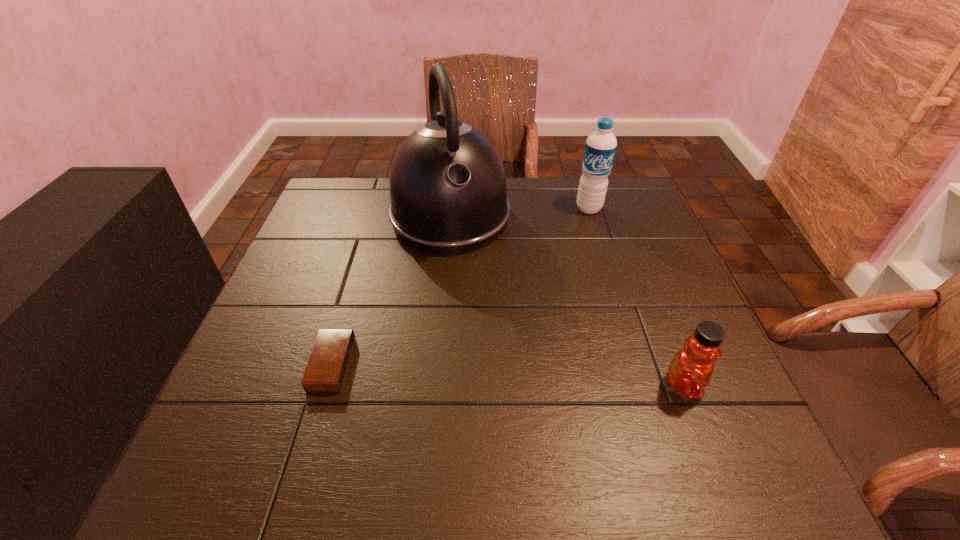
Locate an element on the screen. This screenshot has width=960, height=540. vacant region at the far right corner is located at coordinates (627, 215).

You are a GUI agent. You are given a task and a screenshot of the screen. Output one action in this format:
    pyautogui.click(x=<x>, y=<y>)
    Task: Click on the free spot between the tallest object and the second object from right to left
    
    Given the screenshot: What is the action you would take?
    click(x=519, y=213)

Locate an element on the screen. The height and width of the screenshot is (540, 960). free spot between the tallest object and the shortest object is located at coordinates (391, 291).

In order to click on empty space that is in between the honey and the tallest object in this screenshot , I will do `click(567, 301)`.

At what (x,y) coordinates should I click in order to perform the action: click on empty location between the water bottle and the shortest object. Please return your answer as a coordinate pair (x, y). The height and width of the screenshot is (540, 960). Looking at the image, I should click on (461, 286).

Locate an element on the screen. free space between the second shortest object and the tallest object is located at coordinates (567, 301).

Locate an element on the screen. vacant point located between the honey and the alarm clock is located at coordinates (508, 375).

In order to click on free space between the honey and the second object from right to left in this screenshot , I will do `click(636, 297)`.

Where is `free space between the tallest object and the leftmost object`? The image size is (960, 540). free space between the tallest object and the leftmost object is located at coordinates coord(391,291).

In order to click on free space between the leftmost object and the third object from left to right in this screenshot , I will do `click(461, 286)`.